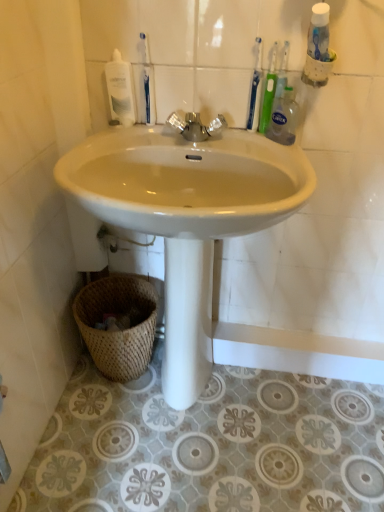
Identify the location of vacant region to the left of green plastic toothbrush at upper right, which is the 3th toothbrush from left to right. Image resolution: width=384 pixels, height=512 pixels. (213, 137).